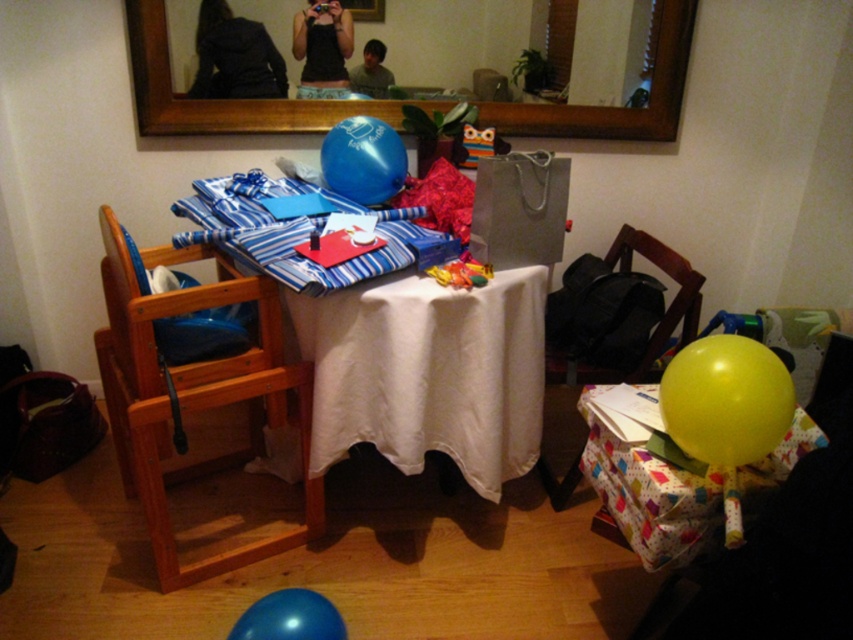
You are organizing a birthday party and need to place a decorative item between the yellow paper at center and the blue rubber balloon at upper center on the table. Where should you place it to ensure it is between them?

The yellow paper at center is located below the blue rubber balloon at upper center, so placing the decorative item between them would require positioning it above the yellow paper at center and below the blue rubber balloon at upper center.

You are organizing a photo shoot in the described room and need to ensure that the black fabric at upper center and the black tank top at center are visible in the reflection of the large mirror. Based on their positions, will both items be reflected in the mirror?

The black fabric at upper center is positioned under the black tank top at center, so the tank top may block the fabric from being fully visible in the mirror reflection. However, since both are positioned at the center area, parts of both might still be reflected depending on the mirror size and angle.

You are organizing a birthday party and need to decide which item to place on the cake. The yellow rubber balloon at lower right and the black tank top at center are both candidates. Based on their sizes, which one is more suitable to be placed on the cake?

The yellow rubber balloon at lower right has a larger size compared to the black tank top at center, so it is more suitable to be placed on the cake as it can provide a more prominent decoration.